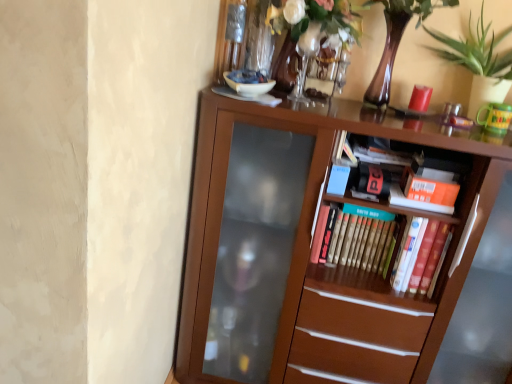
The height and width of the screenshot is (384, 512). What do you see at coordinates (407, 251) in the screenshot? I see `hardcover book at center, positioned as the second paperback book in left-to-right order` at bounding box center [407, 251].

Locate an element on the screen. green leafy plant at upper right is located at coordinates (479, 62).

What do you see at coordinates (320, 247) in the screenshot? I see `brown wooden bookcase at center` at bounding box center [320, 247].

The height and width of the screenshot is (384, 512). What do you see at coordinates (328, 233) in the screenshot?
I see `hardcover book at center, which appears as the 3th paperback book when viewed from the right` at bounding box center [328, 233].

Identify the location of hardcover book at center, which is counted as the 1th paperback book, starting from the left. (328, 233).

Where is `orange matte paperback book at upper right, arranged as the first paperback book when viewed from the right`? The image size is (512, 384). orange matte paperback book at upper right, arranged as the first paperback book when viewed from the right is located at coordinates (431, 190).

Locate an element on the screen. The image size is (512, 384). hardcover book at center, positioned as the second paperback book in left-to-right order is located at coordinates (407, 251).

Is brown wooden bookcase at center placed right next to hardcover book at center, which appears as the 3th paperback book when viewed from the right?

brown wooden bookcase at center and hardcover book at center, which appears as the 3th paperback book when viewed from the right, are not in contact.

Which of these two, brown wooden bookcase at center or hardcover book at center, which appears as the 3th paperback book when viewed from the right, is bigger?

With larger size is brown wooden bookcase at center.

Is brown wooden bookcase at center spatially inside hardcover book at center, which appears as the 3th paperback book when viewed from the right, or outside of it?

brown wooden bookcase at center is spatially situated outside hardcover book at center, which appears as the 3th paperback book when viewed from the right.

From the image's perspective, is brown wooden bookcase at center positioned above or below hardcover book at center, which is counted as the 1th paperback book, starting from the left?

Based on their image positions, brown wooden bookcase at center is located beneath hardcover book at center, which is counted as the 1th paperback book, starting from the left.

In the scene shown: Is orange matte paperback book at upper right, which is counted as the third paperback book, starting from the left, thinner than green leafy plant at upper right?

Yes, orange matte paperback book at upper right, which is counted as the third paperback book, starting from the left, is thinner than green leafy plant at upper right.

Considering the positions of objects orange matte paperback book at upper right, arranged as the first paperback book when viewed from the right, and green leafy plant at upper right in the image provided, who is more to the right, orange matte paperback book at upper right, arranged as the first paperback book when viewed from the right, or green leafy plant at upper right?

Positioned to the right is green leafy plant at upper right.

Would you consider orange matte paperback book at upper right, arranged as the first paperback book when viewed from the right, to be distant from green leafy plant at upper right?

orange matte paperback book at upper right, arranged as the first paperback book when viewed from the right, is near green leafy plant at upper right, not far away.

Is orange matte paperback book at upper right, arranged as the first paperback book when viewed from the right, looking in the opposite direction of hardcover book at center, which appears as the 3th paperback book when viewed from the right?

No, hardcover book at center, which appears as the 3th paperback book when viewed from the right, is not at the back of orange matte paperback book at upper right, arranged as the first paperback book when viewed from the right.

From the image's perspective, is orange matte paperback book at upper right, arranged as the first paperback book when viewed from the right, above or below hardcover book at center, which appears as the 3th paperback book when viewed from the right?

orange matte paperback book at upper right, arranged as the first paperback book when viewed from the right, is situated higher than hardcover book at center, which appears as the 3th paperback book when viewed from the right, in the image.

In terms of height, does orange matte paperback book at upper right, arranged as the first paperback book when viewed from the right, look taller or shorter compared to hardcover book at center, which appears as the 3th paperback book when viewed from the right?

Clearly, orange matte paperback book at upper right, arranged as the first paperback book when viewed from the right, is shorter compared to hardcover book at center, which appears as the 3th paperback book when viewed from the right.

Considering the relative sizes of orange matte paperback book at upper right, which is counted as the third paperback book, starting from the left, and hardcover book at center, which appears as the 3th paperback book when viewed from the right, in the image provided, is orange matte paperback book at upper right, which is counted as the third paperback book, starting from the left, smaller than hardcover book at center, which appears as the 3th paperback book when viewed from the right,?

No, orange matte paperback book at upper right, which is counted as the third paperback book, starting from the left, is not smaller than hardcover book at center, which appears as the 3th paperback book when viewed from the right.

Is hardcover book at center, which is counted as the 1th paperback book, starting from the left, closer to camera compared to hardcover book at center, positioned as the second paperback book in left-to-right order?

No, hardcover book at center, which is counted as the 1th paperback book, starting from the left, is further to the viewer.

Between hardcover book at center, which is counted as the 1th paperback book, starting from the left, and hardcover book at center, placed as the second paperback book when sorted from right to left, which one has less height?

hardcover book at center, which is counted as the 1th paperback book, starting from the left, is shorter.

From the image's perspective, is hardcover book at center, which is counted as the 1th paperback book, starting from the left, above hardcover book at center, positioned as the second paperback book in left-to-right order?

Yes.

Consider the image. Considering the relative sizes of hardcover book at center, which is counted as the 1th paperback book, starting from the left, and hardcover book at center, positioned as the second paperback book in left-to-right order, in the image provided, is hardcover book at center, which is counted as the 1th paperback book, starting from the left, bigger than hardcover book at center, positioned as the second paperback book in left-to-right order,?

Actually, hardcover book at center, which is counted as the 1th paperback book, starting from the left, might be smaller than hardcover book at center, positioned as the second paperback book in left-to-right order.

Does hardcover book at center, which appears as the 3th paperback book when viewed from the right, appear on the right side of translucent glass vase at upper center?

Correct, you'll find hardcover book at center, which appears as the 3th paperback book when viewed from the right, to the right of translucent glass vase at upper center.

Is hardcover book at center, which is counted as the 1th paperback book, starting from the left, facing towards translucent glass vase at upper center?

No.

Can you confirm if hardcover book at center, which is counted as the 1th paperback book, starting from the left, is bigger than translucent glass vase at upper center?

No.

Considering the sizes of objects green leafy plant at upper right and translucent glass vase at upper center in the image provided, who is thinner, green leafy plant at upper right or translucent glass vase at upper center?

green leafy plant at upper right is thinner.

Is green leafy plant at upper right facing away from translucent glass vase at upper center?

green leafy plant at upper right is not turned away from translucent glass vase at upper center.

Is green leafy plant at upper right at the left side of translucent glass vase at upper center?

In fact, green leafy plant at upper right is to the right of translucent glass vase at upper center.

Which is behind, point (474, 85) or point (278, 70)?

Point (278, 70)

Image resolution: width=512 pixels, height=384 pixels. I want to click on the 2nd paperback book counting from the right of the brown wooden bookcase at center, so click(431, 190).

In the scene shown: Which point is more forward, (467, 274) or (451, 194)?

The point (451, 194) is more forward.

Does brown wooden bookcase at center appear on the right side of orange matte paperback book at upper right, arranged as the first paperback book when viewed from the right?

In fact, brown wooden bookcase at center is to the left of orange matte paperback book at upper right, arranged as the first paperback book when viewed from the right.

In the scene shown: From a real-world perspective, relative to orange matte paperback book at upper right, arranged as the first paperback book when viewed from the right, is brown wooden bookcase at center vertically above or below?

brown wooden bookcase at center is situated lower than orange matte paperback book at upper right, arranged as the first paperback book when viewed from the right, in the real world.

Find the location of a particular element. This screenshot has height=384, width=512. bookcase below the hardcover book at center, which appears as the 3th paperback book when viewed from the right (from the image's perspective) is located at coordinates tap(320, 247).

Where is `houseplant that appears above the orange matte paperback book at upper right, arranged as the first paperback book when viewed from the right (from the image's perspective)`? The width and height of the screenshot is (512, 384). houseplant that appears above the orange matte paperback book at upper right, arranged as the first paperback book when viewed from the right (from the image's perspective) is located at coordinates (479, 62).

From the image, which object appears to be farther from hardcover book at center, which is counted as the 1th paperback book, starting from the left, orange matte paperback book at upper right, which is counted as the third paperback book, starting from the left, or hardcover book at center, positioned as the second paperback book in left-to-right order?

The object further to hardcover book at center, which is counted as the 1th paperback book, starting from the left, is orange matte paperback book at upper right, which is counted as the third paperback book, starting from the left.

Looking at the image, which one is located further to green leafy plant at upper right, translucent glass vase at upper center or orange matte paperback book at upper right, arranged as the first paperback book when viewed from the right?

translucent glass vase at upper center.

Considering their positions, is translucent glass vase at upper center positioned closer to hardcover book at center, positioned as the second paperback book in left-to-right order, than green leafy plant at upper right?

The object closer to hardcover book at center, positioned as the second paperback book in left-to-right order, is green leafy plant at upper right.

Looking at the image, which one is located closer to brown wooden bookcase at center, translucent glass vase at upper center or hardcover book at center, positioned as the second paperback book in left-to-right order?

hardcover book at center, positioned as the second paperback book in left-to-right order, is positioned closer to the anchor brown wooden bookcase at center.

When comparing their distances from green leafy plant at upper right, does brown wooden bookcase at center or orange matte paperback book at upper right, arranged as the first paperback book when viewed from the right, seem further?

brown wooden bookcase at center.

Considering their positions, is green leafy plant at upper right positioned further to hardcover book at center, which appears as the 3th paperback book when viewed from the right, than brown wooden bookcase at center?

The object further to hardcover book at center, which appears as the 3th paperback book when viewed from the right, is green leafy plant at upper right.

Based on their spatial positions, is green leafy plant at upper right or hardcover book at center, positioned as the second paperback book in left-to-right order, further from orange matte paperback book at upper right, which is counted as the third paperback book, starting from the left?

The object further to orange matte paperback book at upper right, which is counted as the third paperback book, starting from the left, is green leafy plant at upper right.

Looking at the image, which one is located closer to brown wooden bookcase at center, hardcover book at center, which is counted as the 1th paperback book, starting from the left, or translucent glass vase at upper center?

The object closer to brown wooden bookcase at center is hardcover book at center, which is counted as the 1th paperback book, starting from the left.

Where is `houseplant between translucent glass vase at upper center and hardcover book at center, which appears as the 3th paperback book when viewed from the right, in the up-down direction`? This screenshot has height=384, width=512. houseplant between translucent glass vase at upper center and hardcover book at center, which appears as the 3th paperback book when viewed from the right, in the up-down direction is located at coordinates tap(479, 62).

Identify the location of paperback book that lies between green leafy plant at upper right and hardcover book at center, which appears as the 3th paperback book when viewed from the right, from top to bottom. (431, 190).

The height and width of the screenshot is (384, 512). I want to click on houseplant between translucent glass vase at upper center and brown wooden bookcase at center in the up-down direction, so (x=479, y=62).

This screenshot has height=384, width=512. What are the coordinates of `houseplant that lies between translucent glass vase at upper center and hardcover book at center, positioned as the second paperback book in left-to-right order, from top to bottom` in the screenshot? It's located at (479, 62).